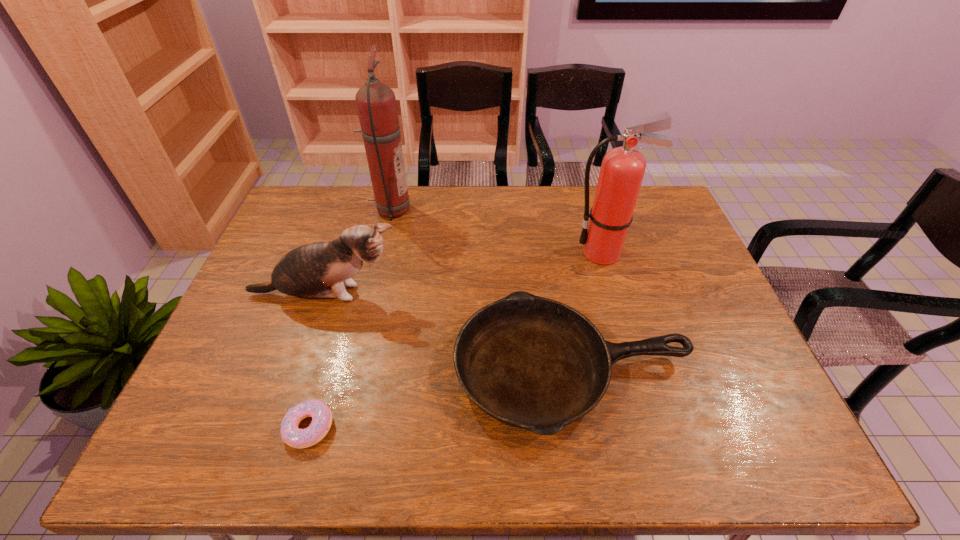
Image resolution: width=960 pixels, height=540 pixels. I want to click on free point located 0.210m on the hose direction of the right fire extinguisher, so click(x=503, y=253).

Locate an element on the screen. This screenshot has height=540, width=960. vacant space located at the face of the third tallest object is located at coordinates (444, 295).

You are a GUI agent. You are given a task and a screenshot of the screen. Output one action in this format:
    pyautogui.click(x=<x>, y=<y>)
    Task: Click on the vacant space situated on the back of the doughnut
    The image size is (960, 540).
    Given the screenshot: What is the action you would take?
    pyautogui.click(x=343, y=309)

Image resolution: width=960 pixels, height=540 pixels. In order to click on object that is at the far edge in this screenshot , I will do `click(376, 103)`.

Identify the location of frying pan situated at the near edge. The image size is (960, 540). (530, 362).

What are the coordinates of `doughnut situated at the near edge` in the screenshot? It's located at (321, 415).

In order to click on object that is at the left edge in this screenshot , I will do `click(304, 272)`.

Locate an element on the screen. The image size is (960, 540). object that is at the right edge is located at coordinates (530, 362).

Locate an element on the screen. Image resolution: width=960 pixels, height=540 pixels. object at the near right corner is located at coordinates (530, 362).

The height and width of the screenshot is (540, 960). I want to click on free location at the far edge of the desktop, so click(x=490, y=186).